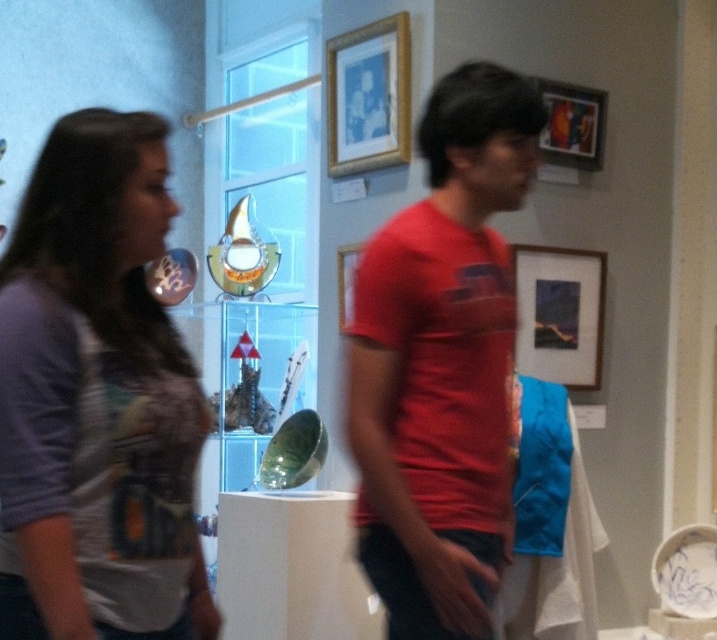
You are standing in the art gallery and want to take a photo of the two people in the foreground. If you focus your camera on point point (584, 280), will the other point point (337, 266) also be in focus? Explain using their positions relative to the camera.

Point (584, 280) is closer to the camera than point (337, 266). If you focus on point (584, 280), the other point (337, 266) may not be in focus because it is further away from the camera.

You are an art curator walking through the gallery. You need to adjust the placement of the matte wooden picture frame at upper right and the wooden picture frame at center. According to their current positions, which one is located to the right of the other?

The matte wooden picture frame at upper right is to the right of the wooden picture frame at center.